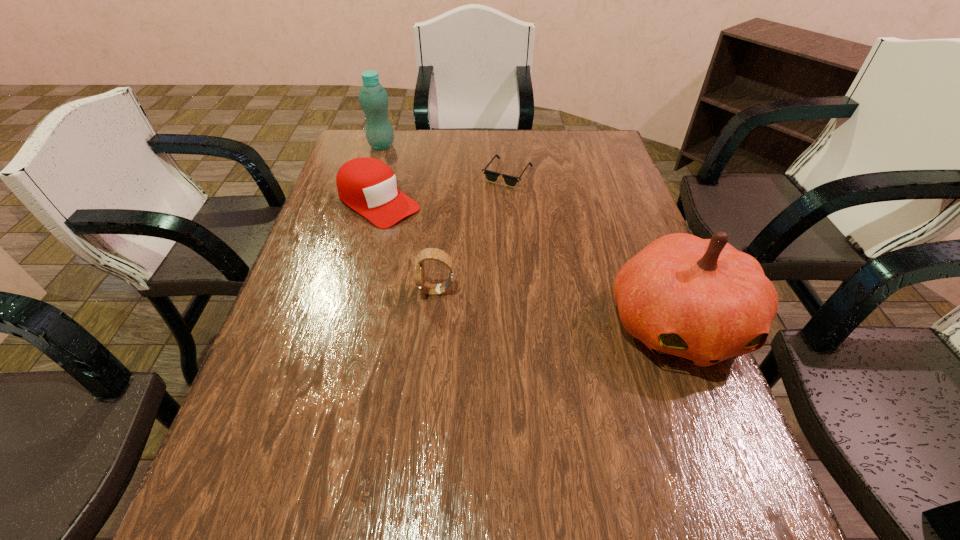
Find the location of a particular element. The image size is (960, 540). free space located 0.160m on the lenses of the second object from right to left is located at coordinates click(x=516, y=222).

Identify the location of free space located 0.200m on the lenses of the second object from right to left. (518, 232).

I want to click on vacant position located 0.210m on the lenses of the second object from right to left, so click(x=518, y=234).

This screenshot has height=540, width=960. I want to click on vacant space located 0.260m at the front cap of the farthest object, so click(422, 190).

At what (x,y) coordinates should I click in order to perform the action: click on free region located 0.260m at the front cap of the farthest object. Please return your answer as a coordinate pair (x, y). This screenshot has height=540, width=960. Looking at the image, I should click on (422, 190).

At what (x,y) coordinates should I click in order to perform the action: click on vacant space situated at the front cap of the farthest object. Please return your answer as a coordinate pair (x, y). Looking at the image, I should click on (412, 179).

Locate an element on the screen. This screenshot has width=960, height=540. free space located 0.160m on the front-facing side of the baseball cap is located at coordinates pyautogui.click(x=444, y=247).

The width and height of the screenshot is (960, 540). I want to click on vacant space located on the front-facing side of the baseball cap, so click(494, 282).

Where is `free space located on the front-facing side of the baseball cap`? free space located on the front-facing side of the baseball cap is located at coordinates (474, 268).

Locate an element on the screen. This screenshot has width=960, height=540. sunglasses that is at the far edge is located at coordinates (491, 176).